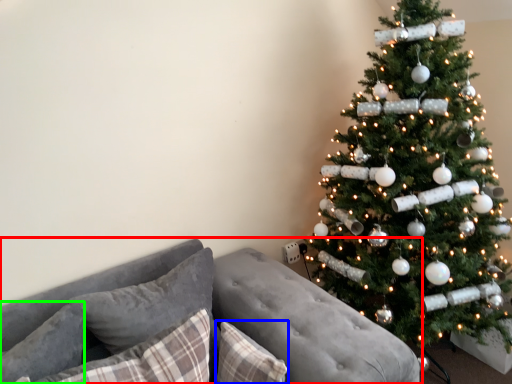
Question: Which is nearer to the studio couch (highlighted by a red box)? pillow (highlighted by a blue box) or pillow (highlighted by a green box).

Choices:
 (A) pillow
 (B) pillow

Answer: (A)